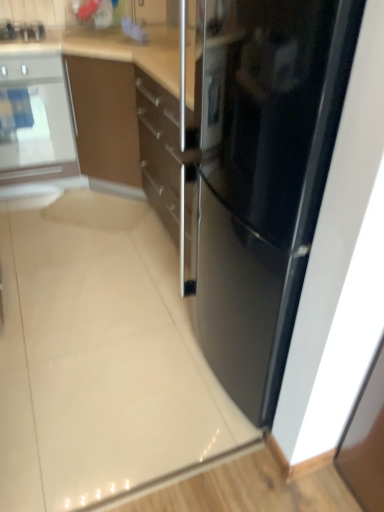
Question: Is sleek stainless steel refrigerator at center inside the boundaries of brushed metal toaster at upper left, or outside?

Choices:
 (A) inside
 (B) outside

Answer: (B)

Question: Looking at the image, does sleek stainless steel refrigerator at center seem bigger or smaller compared to brushed metal toaster at upper left?

Choices:
 (A) small
 (B) big

Answer: (B)

Question: Which of these objects is positioned farthest from the brushed metal toaster at upper left?

Choices:
 (A) satin silver oven at left
 (B) sleek stainless steel refrigerator at center

Answer: (B)

Question: Estimate the real-world distances between objects in this image. Which object is closer to the sleek stainless steel refrigerator at center?

Choices:
 (A) satin silver oven at left
 (B) brushed metal toaster at upper left

Answer: (A)